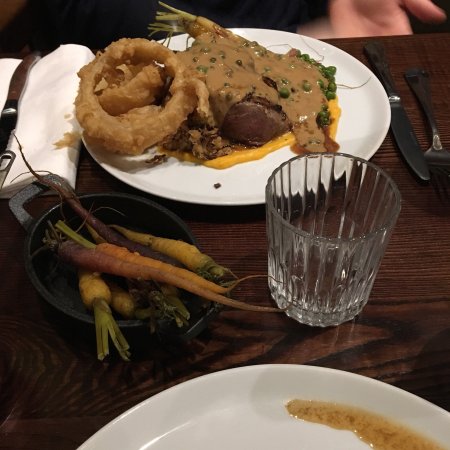
This screenshot has width=450, height=450. In order to click on glass in this screenshot , I will do tap(325, 263).